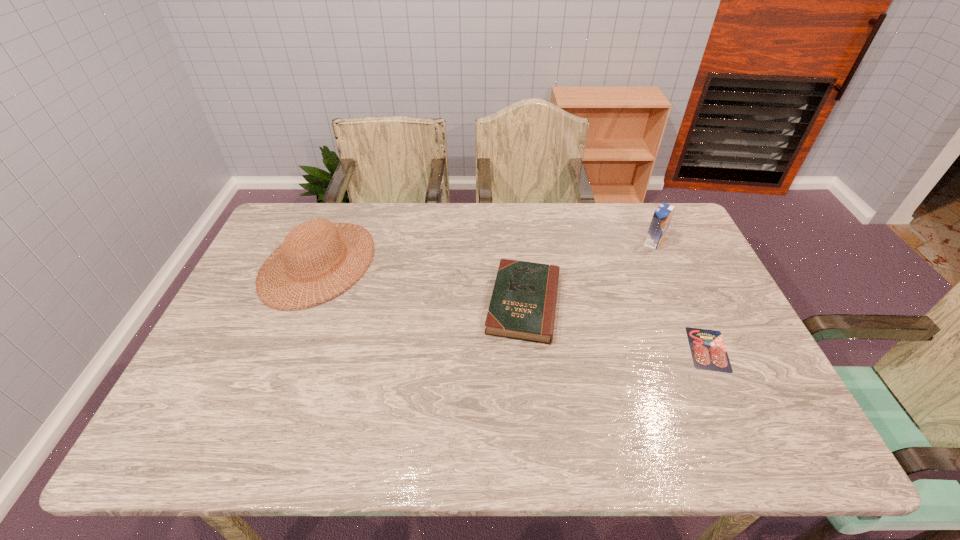
The height and width of the screenshot is (540, 960). Identify the location of free space at the near right corner. (780, 421).

Locate an element on the screen. The height and width of the screenshot is (540, 960). vacant region between the orange_juice and the second shortest object is located at coordinates (588, 273).

I want to click on vacant space that is in between the second tallest object and the tallest object, so click(x=486, y=252).

You are a GUI agent. You are given a task and a screenshot of the screen. Output one action in this format:
    pyautogui.click(x=<x>, y=<y>)
    Task: Click on the free spot between the second object from left to right and the shortest object
    The image size is (960, 540).
    Given the screenshot: What is the action you would take?
    pyautogui.click(x=616, y=326)

Find the location of a particular element. This screenshot has width=960, height=540. unoccupied area between the third tallest object and the salami is located at coordinates (616, 326).

You are a GUI agent. You are given a task and a screenshot of the screen. Output one action in this format:
    pyautogui.click(x=<x>, y=<y>)
    Task: Click on the free space between the salami and the tallest object
    This screenshot has height=540, width=960.
    Given the screenshot: What is the action you would take?
    pyautogui.click(x=681, y=296)

The height and width of the screenshot is (540, 960). What are the coordinates of `empty space between the orange_juice and the second tallest object` in the screenshot? It's located at (486, 252).

I want to click on vacant point located between the orange_juice and the shortest object, so click(681, 296).

Find the location of a particular element. The height and width of the screenshot is (540, 960). vacant point located between the sunhat and the Bible is located at coordinates (421, 283).

Identify the location of free space between the orange_juice and the shortest object. (681, 296).